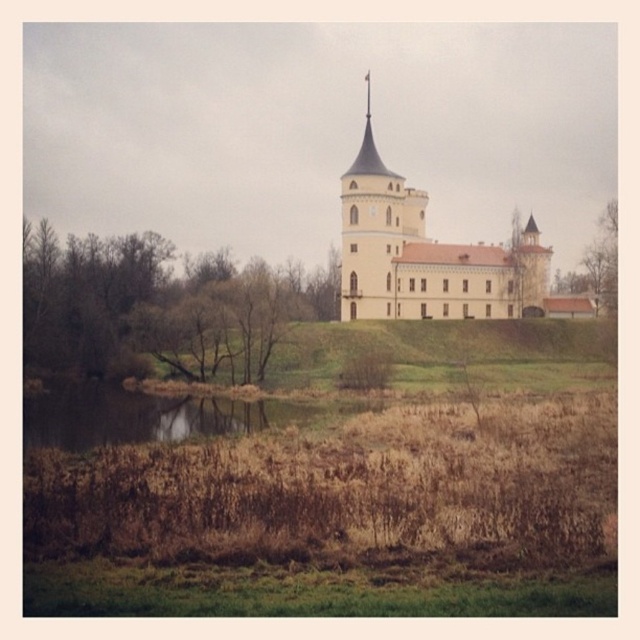
You are a landscape architect designing a new garden. You want to place a small statue between the brown grassy water at lower left and the brown textured tree at right. Which object should the statue be closer to if you want it to be near the larger area?

The statue should be closer to the brown textured tree at right because it occupies more space than the brown grassy water at lower left.

You are a photographer planning to capture the reflection of the white smooth castle at center in the brown grassy water at lower left. Can you confirm if the castle will be visible in the water?

The white smooth castle at center is positioned over brown grassy water at lower left, so its reflection should be visible in the water below.